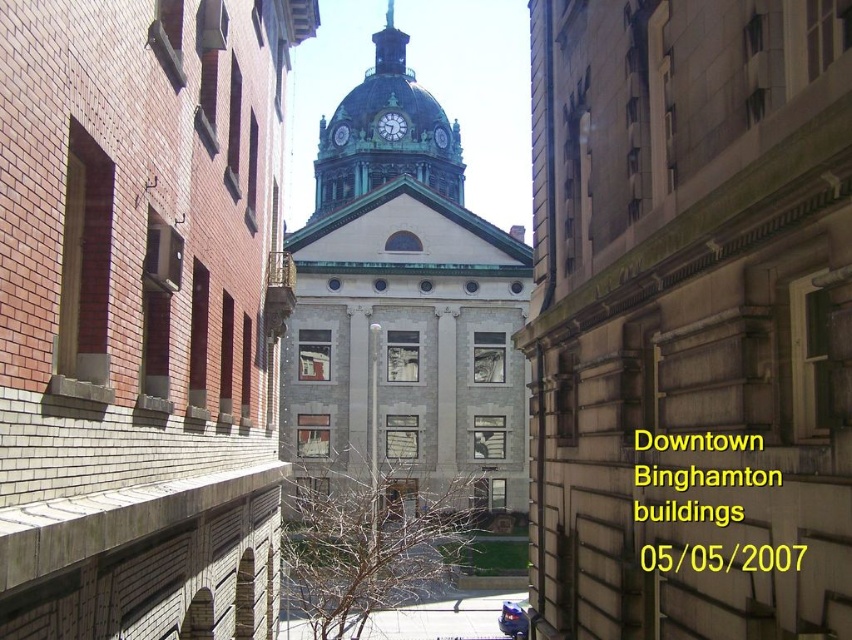
You are standing in the downtown Binghamton area from the image and want to take a photo of both point (354, 289) and point (394, 68) in the frame. Since you want both points to be in focus, which point should you focus on to ensure both are sharp?

You should focus on point (394, 68) because it is farther from the camera than point (354, 289). By focusing on the farther point, the closer point will also be within the depth of field, ensuring both are sharp.

You are standing in front of the downtown Binghamton buildings and want to place a small flag at point (x=418, y=177) and point (x=343, y=134). Which point is closer to you?

Point (x=418, y=177) is closer to the viewer than point (x=343, y=134).

You are an architect analyzing the central structures in the downtown Binghamton image. The green copper spire at center and the green stone clock at center are both part of the central dome. Which of these two elements has a greater width?

The green copper spire at center has a larger width than the green stone clock at center according to the description.